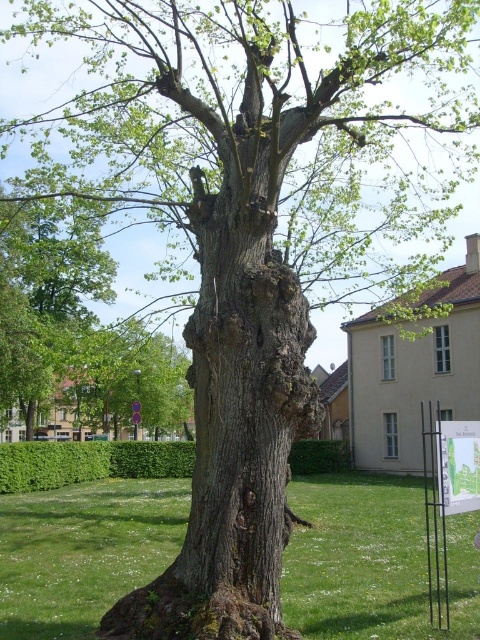
You are standing in the garden and want to place a small bench. You see the green grass at center and the smooth bark tree at center. According to the scene, where should the bench be placed to ensure it is under the shade of the tree?

The bench should be placed on the green grass at center because it is located below the smooth bark tree at center, which means the tree provides shade over the grass.

You are standing in a garden and want to know which object is taller between the green grass at center and the smooth bark tree at center. Based on the scene description, which one is taller?

The smooth bark tree at center is taller than the green grass at center.

You are standing at the base of the large tree with the thick trunk. Looking around, you notice a point marked at coordinates (372,561). What is located at that point?

The point at coordinates (372,561) indicates green grass at center.